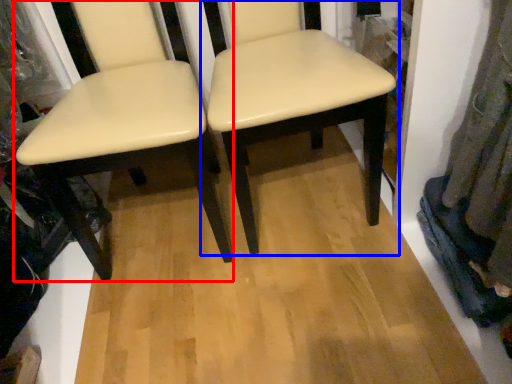
Question: Which object appears closest to the camera in this image, chair (highlighted by a red box) or chair (highlighted by a blue box)?

Choices:
 (A) chair
 (B) chair

Answer: (A)